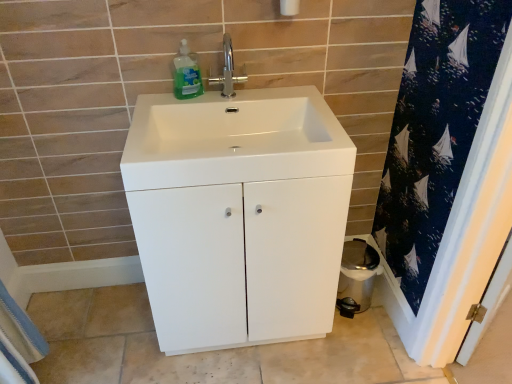
The width and height of the screenshot is (512, 384). In order to click on vacant space positioned to the left of green translucent liquid at upper center in this screenshot , I will do `click(156, 105)`.